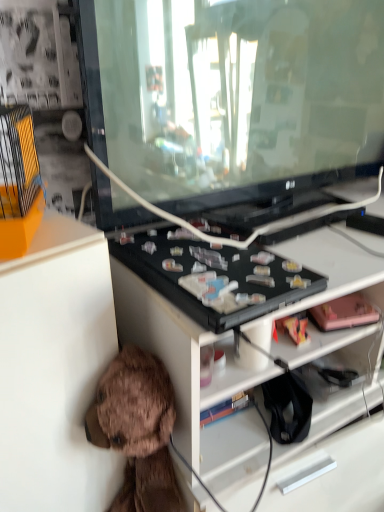
Question: From the image's perspective, is white matte cabinet at lower left above or below brown plush toy at lower left, marked as the first toy in a bottom-to-top arrangement?

Choices:
 (A) above
 (B) below

Answer: (A)

Question: Is point pos(43,283) positioned closer to the camera than point pos(168,395)?

Choices:
 (A) closer
 (B) farther

Answer: (A)

Question: Estimate the real-world distances between objects in this image. Which object is closer to the white matte cabinet at lower left?

Choices:
 (A) transparent glass tv at center
 (B) brown plush toy at lower left, which is the 1th toy in left-to-right order
 (C) pink matte toy at right, the first toy when ordered from right to left

Answer: (B)

Question: Based on their relative distances, which object is nearer to the pink matte toy at right, which is the second toy in bottom-to-top order?

Choices:
 (A) brown plush toy at lower left, which is the 1th toy in left-to-right order
 (B) white matte cabinet at lower left
 (C) transparent glass tv at center

Answer: (A)